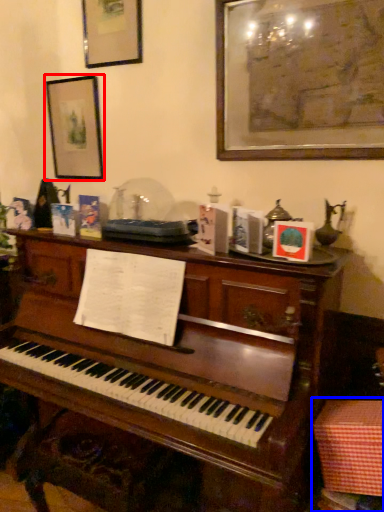
Question: Which of the following is the closest to the observer, picture frame (highlighted by a red box) or table (highlighted by a blue box)?

Choices:
 (A) picture frame
 (B) table

Answer: (B)